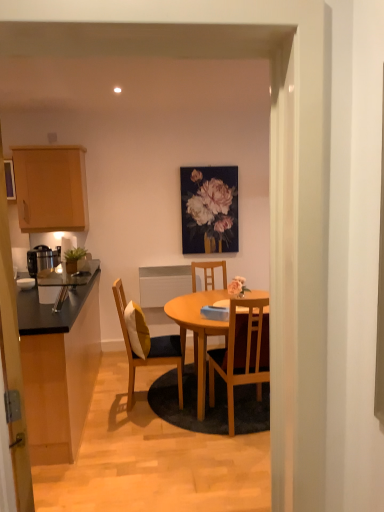
Question: Is wooden cabinet at upper left, the first cabinetry when ordered from top to bottom, to the left or to the right of transparent glass door at left in the image?

Choices:
 (A) right
 (B) left

Answer: (B)

Question: Considering the positions of point (44, 182) and point (6, 353), is point (44, 182) closer or farther from the camera than point (6, 353)?

Choices:
 (A) closer
 (B) farther

Answer: (B)

Question: Considering the real-world distances, which object is closest to the matte floral painting at upper center?

Choices:
 (A) black laminate countertop at left, marked as the second cabinetry in a top-to-bottom arrangement
 (B) wooden chair with cushion at center, the 2th chair when ordered from front to back
 (C) wooden cabinet at upper left, the first cabinetry when ordered from top to bottom
 (D) wooden chair at center, which is the 3th chair from front to back
 (E) transparent glass door at left

Answer: (D)

Question: Considering the real-world distances, which object is farthest from the black laminate countertop at left, marked as the second cabinetry in a top-to-bottom arrangement?

Choices:
 (A) wooden chair at center, arranged as the third chair when viewed from the left
 (B) transparent glass door at left
 (C) matte floral painting at upper center
 (D) satin silver coffee maker at left
 (E) wooden chair at center, the 2th chair in the right-to-left sequence

Answer: (B)